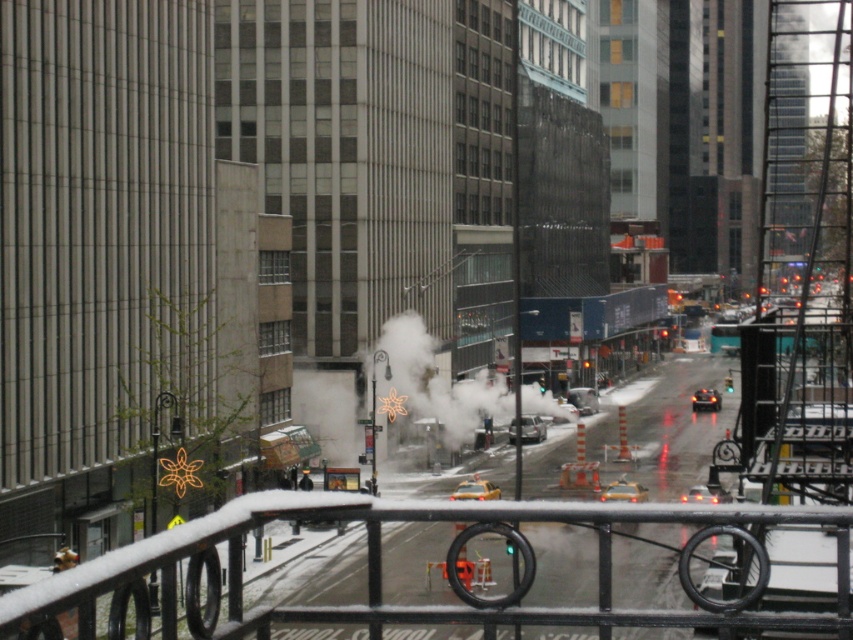
Question: Does silver metallic sedan at center appear on the left side of shiny black car at center?

Choices:
 (A) no
 (B) yes

Answer: (B)

Question: Considering the relative positions of silver metallic sedan at center and shiny black car at center in the image provided, where is silver metallic sedan at center located with respect to shiny black car at center?

Choices:
 (A) right
 (B) left

Answer: (B)

Question: Among these objects, which one is farthest from the camera?

Choices:
 (A) silver metallic sedan at center
 (B) shiny black car at center

Answer: (B)

Question: Which object appears closest to the camera in this image?

Choices:
 (A) silver metallic sedan at center
 (B) shiny black car at center

Answer: (A)

Question: Is silver metallic sedan at center positioned at the back of shiny black car at center?

Choices:
 (A) no
 (B) yes

Answer: (A)